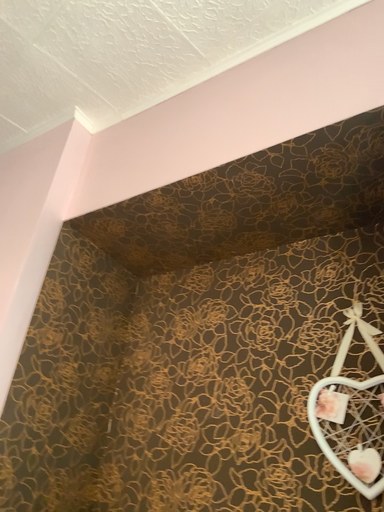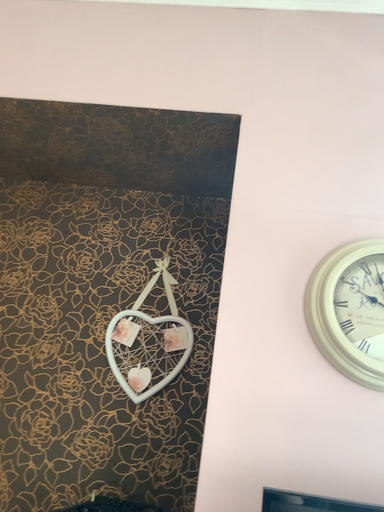
Question: How did the camera likely rotate when shooting the video?

Choices:
 (A) rotated upward
 (B) rotated downward

Answer: (B)